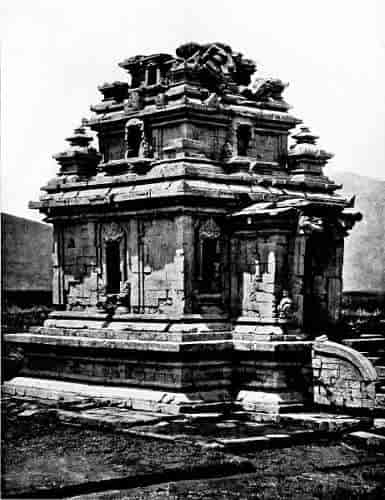
Where is `hand rail`? The image size is (385, 500). hand rail is located at coordinates (347, 349).